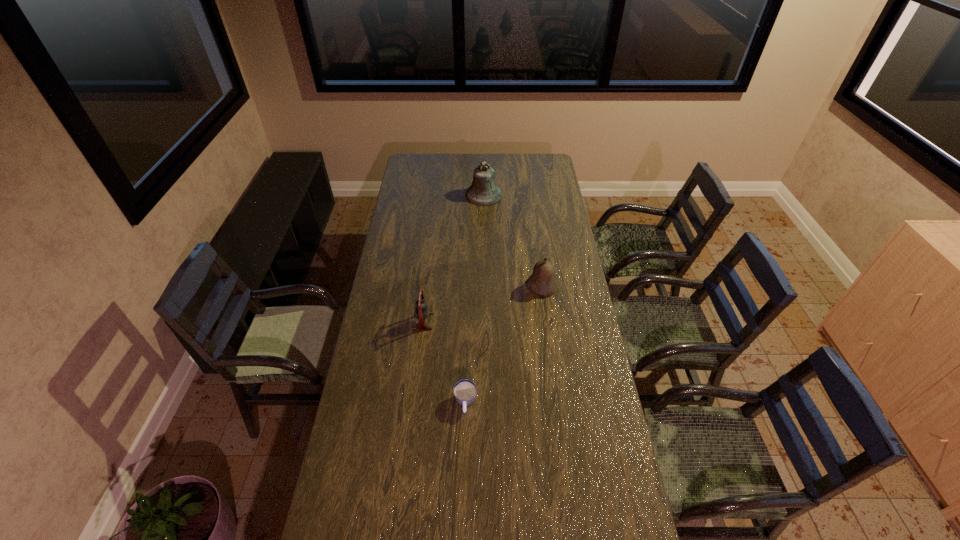
Locate an element on the screen. The image size is (960, 540). the farthest object is located at coordinates (483, 192).

Locate an element on the screen. Image resolution: width=960 pixels, height=540 pixels. the farthest bell is located at coordinates (483, 192).

Image resolution: width=960 pixels, height=540 pixels. In order to click on the leftmost bell in this screenshot , I will do pos(421,312).

Identify the location of the nearest bell. (421, 312).

The width and height of the screenshot is (960, 540). What are the coordinates of `the rightmost object` in the screenshot? It's located at (541, 282).

At what (x,y) coordinates should I click in order to perform the action: click on the third nearest object. Please return your answer as a coordinate pair (x, y). The width and height of the screenshot is (960, 540). Looking at the image, I should click on (541, 282).

At what (x,y) coordinates should I click in order to perform the action: click on cup. Please return your answer as a coordinate pair (x, y). This screenshot has width=960, height=540. Looking at the image, I should click on (464, 391).

What are the coordinates of `the nearest object` in the screenshot? It's located at (464, 391).

Locate an element on the screen. This screenshot has height=540, width=960. vacant space located on the right of the second bell from right to left is located at coordinates (555, 195).

Identify the location of free space located on the front of the leftmost object. (413, 410).